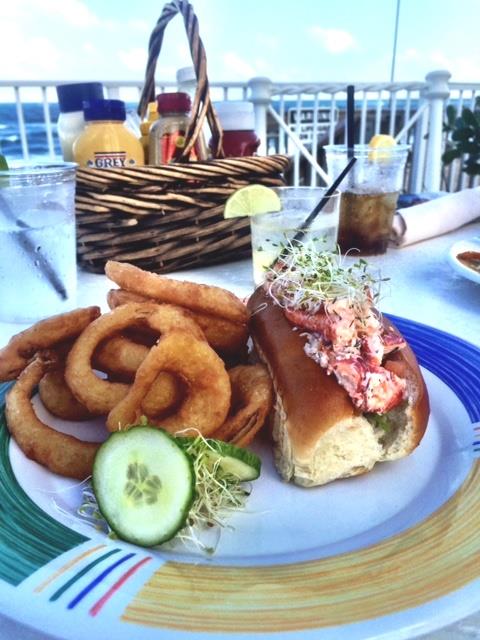
Find the location of a particular element. yellow part of plate is located at coordinates (363, 584).